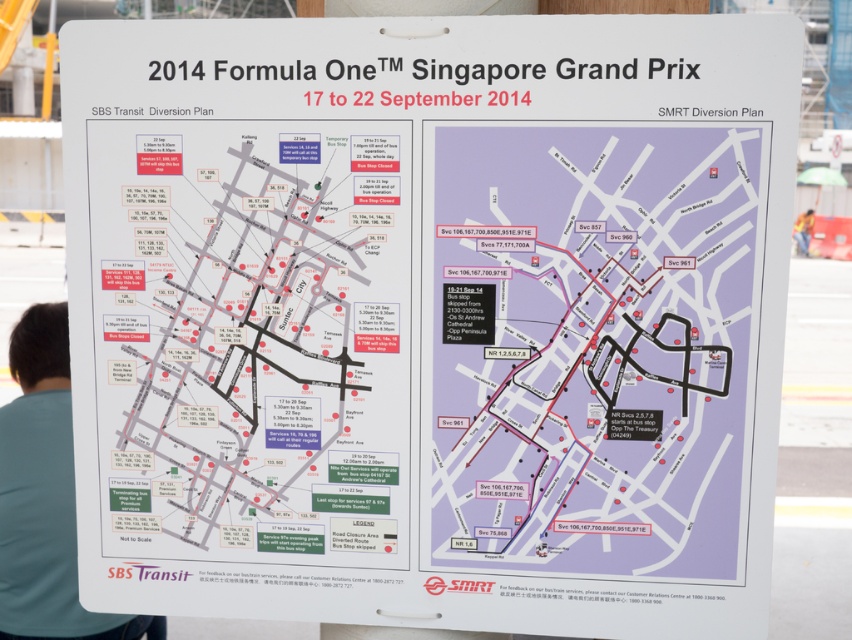
Question: Where is purple paper map at center located in relation to blue fabric shirt at lower left in the image?

Choices:
 (A) left
 (B) right

Answer: (B)

Question: Is purple paper map at center below blue fabric shirt at lower left?

Choices:
 (A) yes
 (B) no

Answer: (B)

Question: Which point is closer to the camera taking this photo?

Choices:
 (A) pos(677,339)
 (B) pos(60,500)

Answer: (A)

Question: Does purple paper map at center have a greater width compared to blue fabric shirt at lower left?

Choices:
 (A) no
 (B) yes

Answer: (B)